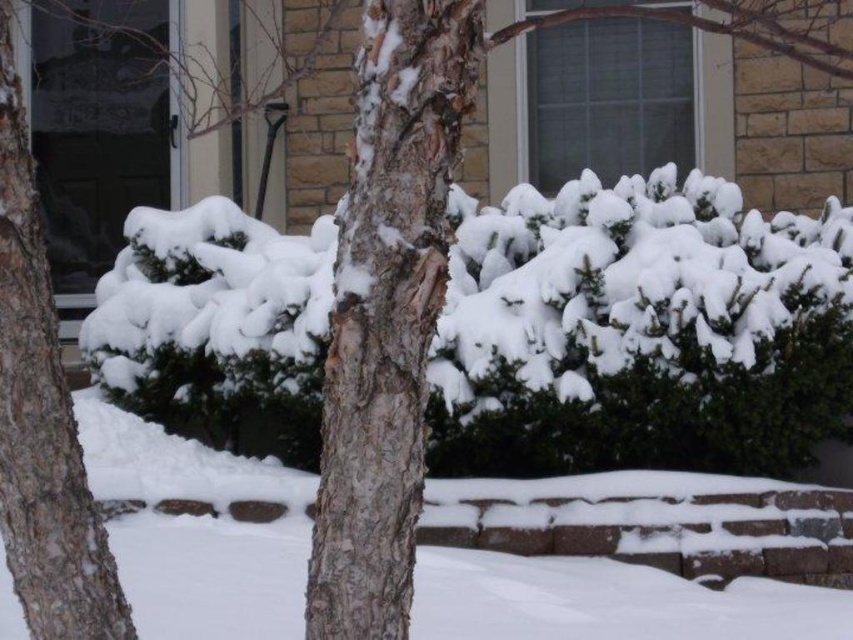
Question: Estimate the real-world distances between objects in this image. Which object is closer to the smooth bark tree trunk at left?

Choices:
 (A) bark textured tree trunk at center
 (B) white fluffy hedge at center

Answer: (A)

Question: Estimate the real-world distances between objects in this image. Which object is farther from the smooth bark tree trunk at left?

Choices:
 (A) white fluffy hedge at center
 (B) bark textured tree trunk at center

Answer: (A)

Question: Is white fluffy hedge at center above smooth bark tree trunk at left?

Choices:
 (A) no
 (B) yes

Answer: (B)

Question: Is white fluffy hedge at center positioned before smooth bark tree trunk at left?

Choices:
 (A) no
 (B) yes

Answer: (A)

Question: Is bark textured tree trunk at center to the right of smooth bark tree trunk at left from the viewer's perspective?

Choices:
 (A) yes
 (B) no

Answer: (A)

Question: Among these points, which one is farthest from the camera?

Choices:
 (A) (318, 333)
 (B) (33, 339)
 (C) (480, 35)

Answer: (A)